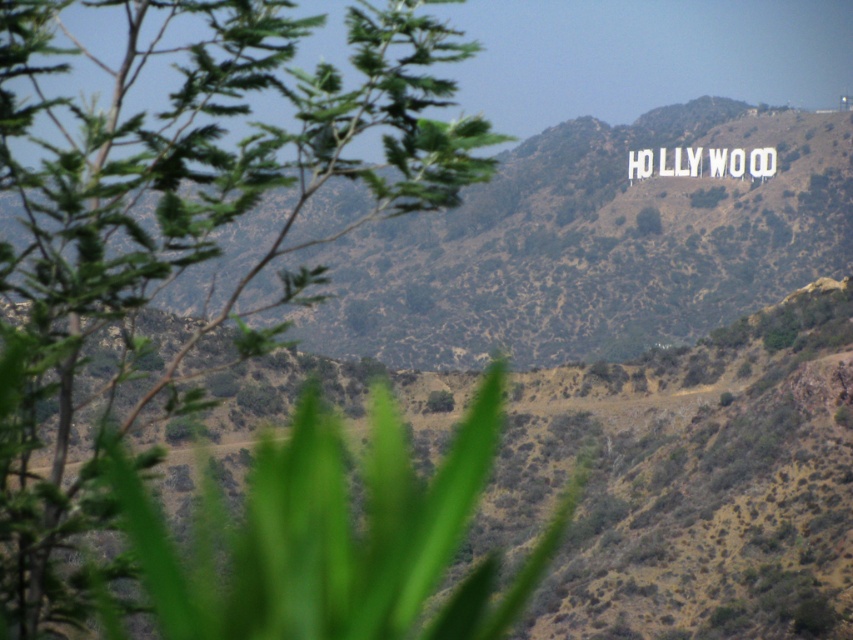
Question: Can you confirm if green leafy tree at left is thinner than green grassy hillside at upper center?

Choices:
 (A) yes
 (B) no

Answer: (A)

Question: Which object appears farthest from the camera in this image?

Choices:
 (A) green grassy hillside at upper center
 (B) green leafy tree at left

Answer: (A)

Question: Which point is farther to the camera?

Choices:
 (A) green grassy hillside at upper center
 (B) green leafy tree at left

Answer: (A)

Question: Among these objects, which one is nearest to the camera?

Choices:
 (A) green leafy tree at left
 (B) green grassy hillside at upper center

Answer: (A)

Question: In this image, where is green leafy tree at left located relative to green grassy hillside at upper center?

Choices:
 (A) right
 (B) left

Answer: (B)

Question: Is green leafy tree at left closer to the viewer compared to green grassy hillside at upper center?

Choices:
 (A) yes
 (B) no

Answer: (A)